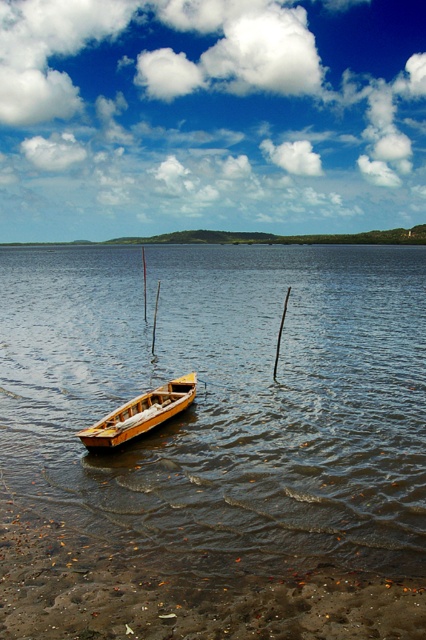
You are planning to place a small floating dock in the lake. Given the presence of the brown wooden water at center and the wooden boat at center, which object would you need to consider in terms of space availability for the dock?

The brown wooden water at center has a larger size compared to wooden boat at center, so the dock should be placed near the brown wooden water at center to ensure sufficient space.

You are standing on the sandy shore and see the brown wooden water at center and the wooden boat at center. Which object is higher in position?

The brown wooden water at center is above the wooden boat at center, so it is higher in position.